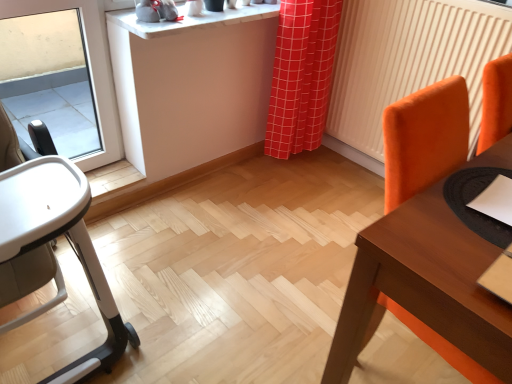
Find the location of a particular element. This screenshot has height=384, width=512. vacant space underneath beige fabric highchair at left (from a real-world perspective) is located at coordinates (54, 332).